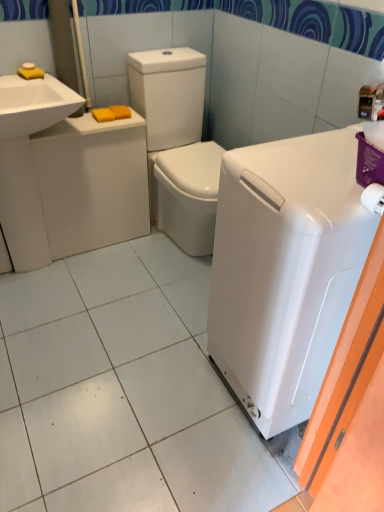
Question: From a real-world perspective, relative to white glossy washing machine at right, is white glossy sink at upper left, the 2th sink positioned from the bottom, vertically above or below?

Choices:
 (A) below
 (B) above

Answer: (B)

Question: From the image's perspective, relative to white glossy washing machine at right, is white glossy sink at upper left, marked as the first sink in a top-to-bottom arrangement, above or below?

Choices:
 (A) above
 (B) below

Answer: (A)

Question: Which of these objects is positioned closest to the white glossy sink at left, acting as the second sink starting from the top?

Choices:
 (A) white glossy washing machine at right
 (B) white glossy sink at upper left, marked as the first sink in a top-to-bottom arrangement
 (C) white glossy washer at center

Answer: (B)

Question: Considering the real-world distances, which object is farthest from the white glossy sink at left, acting as the second sink starting from the top?

Choices:
 (A) white glossy sink at upper left, marked as the first sink in a top-to-bottom arrangement
 (B) white glossy washer at center
 (C) white glossy washing machine at right

Answer: (C)